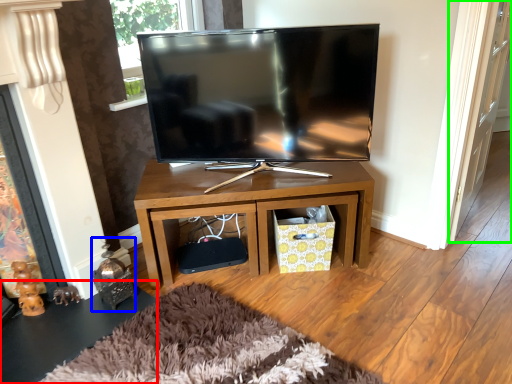
Question: Which is nearer to the side table (highlighted by a red box)? toy (highlighted by a blue box) or glass door (highlighted by a green box).

Choices:
 (A) toy
 (B) glass door

Answer: (A)